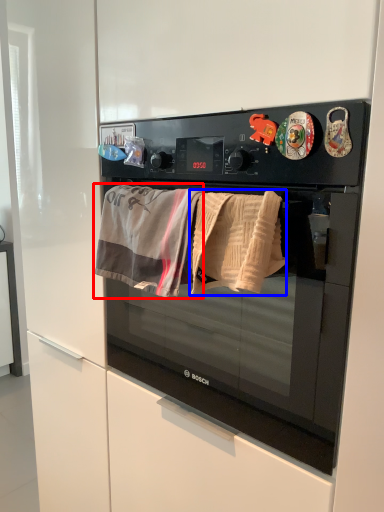
Question: Which of the following is the farthest to the observer, beach towel (highlighted by a red box) or beach towel (highlighted by a blue box)?

Choices:
 (A) beach towel
 (B) beach towel

Answer: (A)